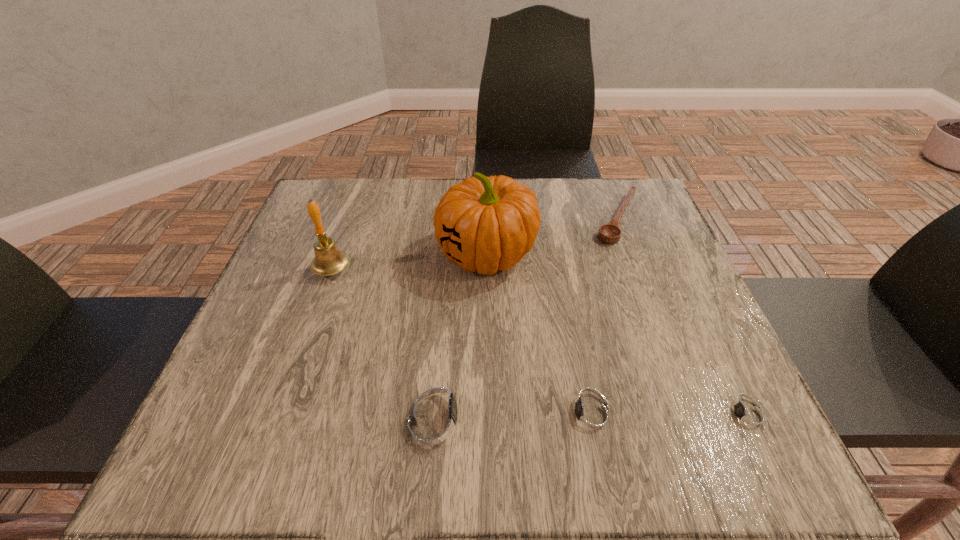
Please point a spot on the left to add another watch. Please provide its 2D coordinates. Your answer should be formatted as a tuple, i.e. [(x, y)], where the tuple contains the x and y coordinates of a point satisfying the conditions above.

[(279, 414)]